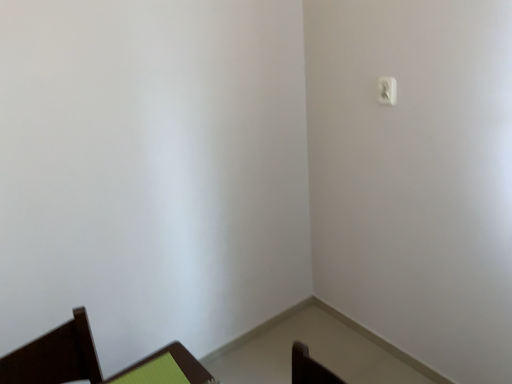
Question: Is white plastic light switch at upper right beside green fabric chair at lower left?

Choices:
 (A) no
 (B) yes

Answer: (A)

Question: Considering the relative sizes of white plastic light switch at upper right and green fabric chair at lower left in the image provided, is white plastic light switch at upper right shorter than green fabric chair at lower left?

Choices:
 (A) no
 (B) yes

Answer: (A)

Question: Considering the relative positions of white plastic light switch at upper right and green fabric chair at lower left in the image provided, is white plastic light switch at upper right behind green fabric chair at lower left?

Choices:
 (A) yes
 (B) no

Answer: (A)

Question: Does white plastic light switch at upper right turn towards green fabric chair at lower left?

Choices:
 (A) yes
 (B) no

Answer: (A)

Question: From a real-world perspective, is white plastic light switch at upper right over green fabric chair at lower left?

Choices:
 (A) yes
 (B) no

Answer: (A)

Question: Is white plastic light switch at upper right thinner than green fabric chair at lower left?

Choices:
 (A) no
 (B) yes

Answer: (B)

Question: Is green fabric chair at lower left behind white plastic light switch at upper right?

Choices:
 (A) yes
 (B) no

Answer: (B)

Question: From a real-world perspective, is green fabric chair at lower left located higher than white plastic light switch at upper right?

Choices:
 (A) yes
 (B) no

Answer: (B)

Question: Is green fabric chair at lower left to the right of white plastic light switch at upper right from the viewer's perspective?

Choices:
 (A) yes
 (B) no

Answer: (B)

Question: Considering the relative sizes of green fabric chair at lower left and white plastic light switch at upper right in the image provided, is green fabric chair at lower left shorter than white plastic light switch at upper right?

Choices:
 (A) yes
 (B) no

Answer: (A)

Question: Does green fabric chair at lower left turn towards white plastic light switch at upper right?

Choices:
 (A) no
 (B) yes

Answer: (A)

Question: From the image's perspective, would you say green fabric chair at lower left is shown under white plastic light switch at upper right?

Choices:
 (A) no
 (B) yes

Answer: (B)

Question: From a real-world perspective, is white plastic light switch at upper right above or below green fabric chair at lower left?

Choices:
 (A) above
 (B) below

Answer: (A)